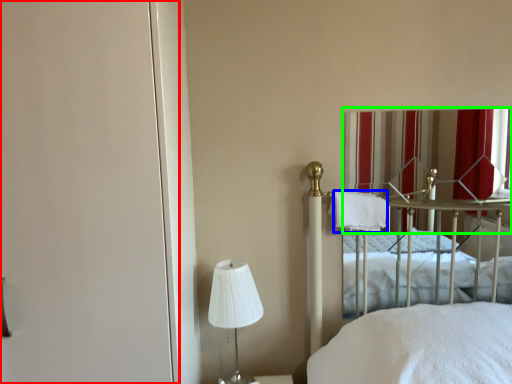
Question: Which object is the closest to the screen door (highlighted by a red box)? Choose among these: cloth (highlighted by a blue box) or curtain (highlighted by a green box).

Choices:
 (A) cloth
 (B) curtain

Answer: (A)